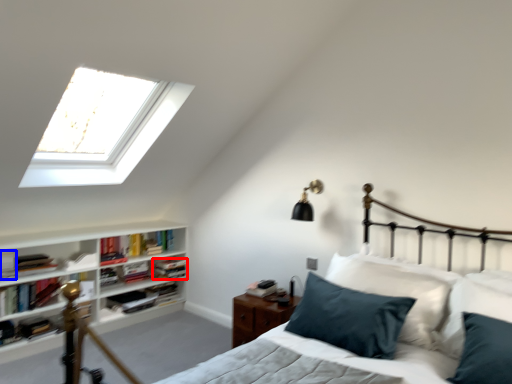
Question: Which of the following is the farthest to the observer, book (highlighted by a red box) or book (highlighted by a blue box)?

Choices:
 (A) book
 (B) book

Answer: (A)